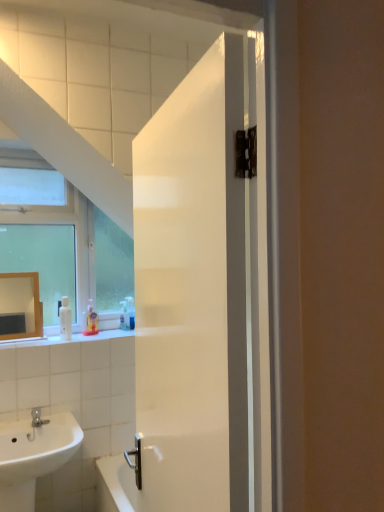
Question: Can you confirm if white glossy sink at lower left is bigger than white glossy soap dispenser at left?

Choices:
 (A) no
 (B) yes

Answer: (B)

Question: From the image's perspective, is white glossy sink at lower left on top of white glossy soap dispenser at left?

Choices:
 (A) no
 (B) yes

Answer: (A)

Question: From a real-world perspective, does white glossy sink at lower left sit lower than white glossy soap dispenser at left?

Choices:
 (A) yes
 (B) no

Answer: (A)

Question: Is white glossy sink at lower left turned away from white glossy soap dispenser at left?

Choices:
 (A) yes
 (B) no

Answer: (B)

Question: Considering the relative sizes of white glossy sink at lower left and white glossy soap dispenser at left in the image provided, is white glossy sink at lower left taller than white glossy soap dispenser at left?

Choices:
 (A) no
 (B) yes

Answer: (B)

Question: Is white glossy door at center inside the boundaries of matte gold mirror at upper left, or outside?

Choices:
 (A) inside
 (B) outside

Answer: (B)

Question: Considering the positions of white glossy door at center and matte gold mirror at upper left in the image, is white glossy door at center bigger or smaller than matte gold mirror at upper left?

Choices:
 (A) big
 (B) small

Answer: (A)

Question: In terms of height, does white glossy door at center look taller or shorter compared to matte gold mirror at upper left?

Choices:
 (A) short
 (B) tall

Answer: (B)

Question: Relative to matte gold mirror at upper left, is white glossy door at center in front or behind?

Choices:
 (A) front
 (B) behind

Answer: (A)

Question: Is white glossy door at center inside or outside of translucent plastic soap dispenser at lower left, which is counted as the first toiletry, starting from the front?

Choices:
 (A) inside
 (B) outside

Answer: (B)

Question: In the image, is white glossy door at center positioned in front of or behind translucent plastic soap dispenser at lower left, which is counted as the first toiletry, starting from the front?

Choices:
 (A) behind
 (B) front

Answer: (B)

Question: Based on their positions, is white glossy door at center located to the left or right of translucent plastic soap dispenser at lower left, the 2th toiletry when ordered from back to front?

Choices:
 (A) left
 (B) right

Answer: (B)

Question: In terms of size, does white glossy door at center appear bigger or smaller than translucent plastic soap dispenser at lower left, the 2th toiletry when ordered from back to front?

Choices:
 (A) big
 (B) small

Answer: (A)

Question: Is white glossy soap dispenser at left taller or shorter than white glossy door at center?

Choices:
 (A) short
 (B) tall

Answer: (A)

Question: Visually, is white glossy soap dispenser at left positioned to the left or to the right of white glossy door at center?

Choices:
 (A) right
 (B) left

Answer: (B)